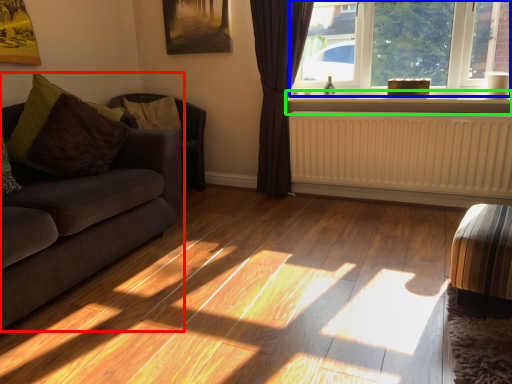
Question: Which object is positioned farthest from studio couch (highlighted by a red box)? Select from window (highlighted by a blue box) and window sill (highlighted by a green box).

Choices:
 (A) window
 (B) window sill

Answer: (A)